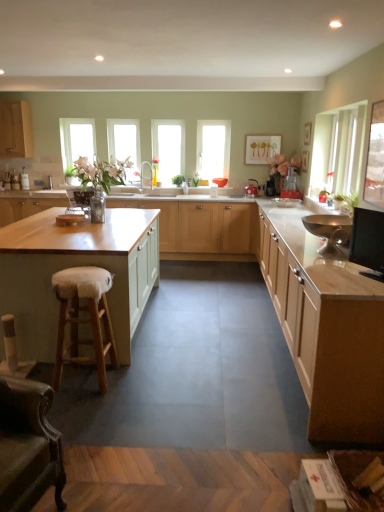
Question: Can you confirm if metallic red kettle at center, positioned as the 2th appliance in bottom-to-top order, is positioned to the left of wooden island at center, acting as the 4th cabinetry starting from the bottom?

Choices:
 (A) no
 (B) yes

Answer: (A)

Question: Is metallic red kettle at center, the second appliance in the back-to-front sequence, shorter than wooden island at center, the second cabinetry viewed from the top?

Choices:
 (A) no
 (B) yes

Answer: (B)

Question: Is wooden island at center, acting as the 4th cabinetry starting from the bottom, a part of metallic red kettle at center, which appears as the 2th appliance when viewed from the front?

Choices:
 (A) no
 (B) yes

Answer: (A)

Question: Is metallic red kettle at center, which is the 2th appliance in top-to-bottom order, directly adjacent to wooden island at center, the second cabinetry viewed from the top?

Choices:
 (A) no
 (B) yes

Answer: (A)

Question: Is metallic red kettle at center, which appears as the 2th appliance when viewed from the front, not within wooden island at center, the second cabinetry viewed from the top?

Choices:
 (A) yes
 (B) no

Answer: (A)

Question: In terms of width, does matte wood cabinet at upper left, arranged as the 5th cabinetry when ordered from the bottom, look wider or thinner when compared to white furry stool at lower left?

Choices:
 (A) wide
 (B) thin

Answer: (A)

Question: From a real-world perspective, relative to white furry stool at lower left, is matte wood cabinet at upper left, arranged as the 5th cabinetry when ordered from the bottom, vertically above or below?

Choices:
 (A) below
 (B) above

Answer: (B)

Question: Considering the positions of point (14, 135) and point (92, 309), is point (14, 135) closer or farther from the camera than point (92, 309)?

Choices:
 (A) farther
 (B) closer

Answer: (A)

Question: From their relative heights in the image, would you say matte wood cabinet at upper left, positioned as the 1th cabinetry in top-to-bottom order, is taller or shorter than white furry stool at lower left?

Choices:
 (A) tall
 (B) short

Answer: (A)

Question: Is point (127, 135) closer or farther from the camera than point (77, 355)?

Choices:
 (A) closer
 (B) farther

Answer: (B)

Question: Is clear glass window at center, the third window from the right, wider or thinner than white furry stool at lower left?

Choices:
 (A) thin
 (B) wide

Answer: (A)

Question: From a real-world perspective, relative to white furry stool at lower left, is clear glass window at center, which is the second window in left-to-right order, vertically above or below?

Choices:
 (A) above
 (B) below

Answer: (A)

Question: From the image's perspective, is clear glass window at center, which is the second window in left-to-right order, positioned above or below white furry stool at lower left?

Choices:
 (A) below
 (B) above

Answer: (B)

Question: Considering the relative positions of matte wood cabinets at center, which is the third cabinetry in top-to-bottom order, and metallic silver toaster at center, marked as the third appliance in a front-to-back arrangement, in the image provided, is matte wood cabinets at center, which is the third cabinetry in top-to-bottom order, to the left or to the right of metallic silver toaster at center, marked as the third appliance in a front-to-back arrangement,?

Choices:
 (A) right
 (B) left

Answer: (B)

Question: Would you say matte wood cabinets at center, the 3th cabinetry in the bottom-to-top sequence, is inside or outside metallic silver toaster at center, which is the 1th appliance in top-to-bottom order?

Choices:
 (A) inside
 (B) outside

Answer: (B)